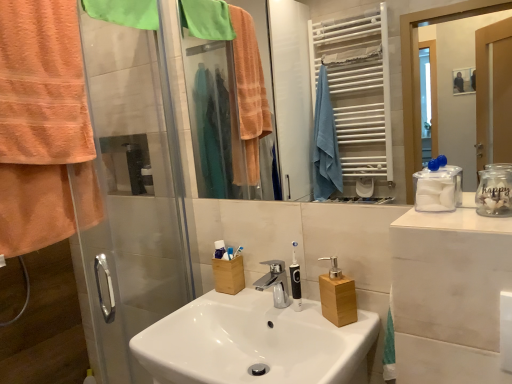
I want to click on free location in front of transparent plastic container at right, so pyautogui.click(x=457, y=218).